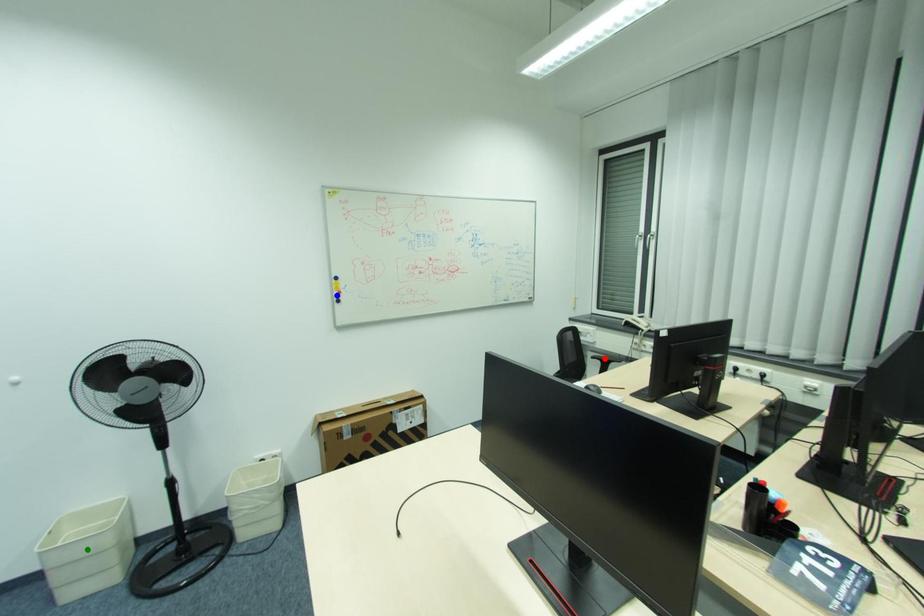
Order these from nearest to farthest:
1. red point
2. green point
3. blue point

1. green point
2. blue point
3. red point